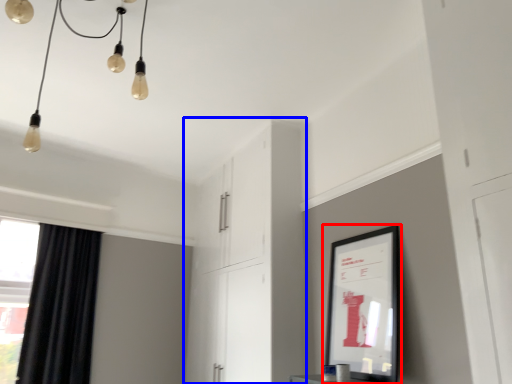
Question: Which object is closer to the camera taking this photo, picture frame (highlighted by a red box) or dresser (highlighted by a blue box)?

Choices:
 (A) picture frame
 (B) dresser

Answer: (A)